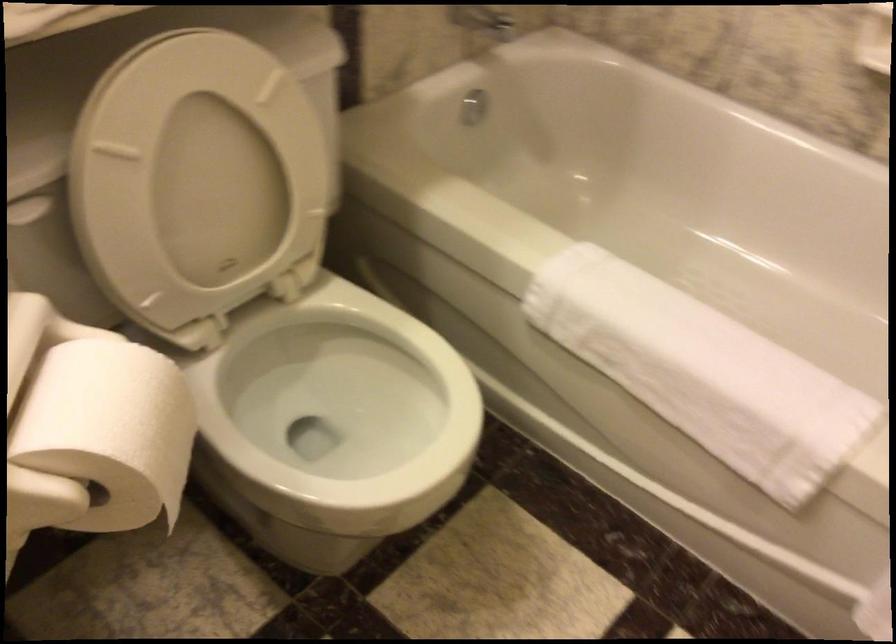
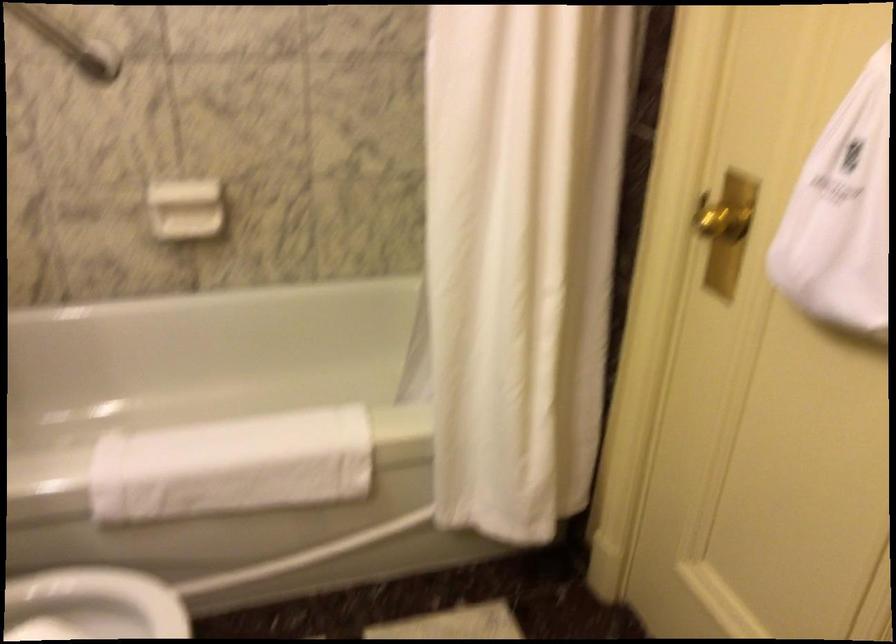
Locate, in the second image, the point that corresponds to pixel 668 351 in the first image.

(231, 466)